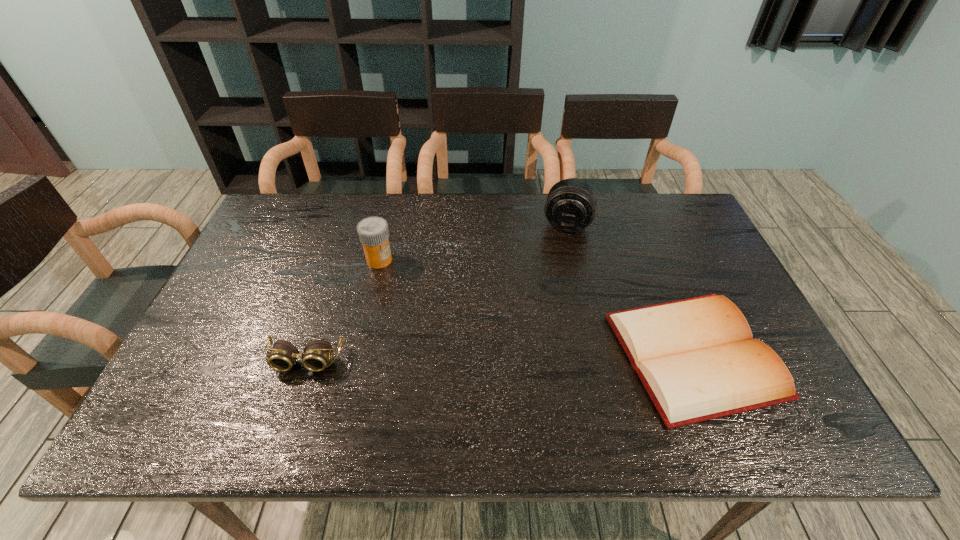
Where is `vacant area at the left edge`? The image size is (960, 540). vacant area at the left edge is located at coordinates (220, 363).

I want to click on vacant region at the right edge, so click(x=712, y=270).

Locate an element on the screen. This screenshot has width=960, height=540. vacant region at the far left corner is located at coordinates (300, 232).

This screenshot has height=540, width=960. In the image, there is a desktop. Identify the location of blank space at the near left corner. (185, 378).

Locate an element on the screen. The height and width of the screenshot is (540, 960). free location at the far right corner of the desktop is located at coordinates [x=670, y=200].

Find the location of a particular element. vacant space that is in between the medicine and the second shortest object is located at coordinates (343, 310).

Where is `vacant region between the Bible and the third shortest object`? This screenshot has height=540, width=960. vacant region between the Bible and the third shortest object is located at coordinates (537, 307).

This screenshot has height=540, width=960. Identify the location of unoccupied area between the third shortest object and the tallest object. (473, 241).

Where is `free spot between the tallest object and the third tallest object`? Image resolution: width=960 pixels, height=540 pixels. free spot between the tallest object and the third tallest object is located at coordinates (436, 292).

Where is `free space between the medicine and the shortest object`? The height and width of the screenshot is (540, 960). free space between the medicine and the shortest object is located at coordinates (537, 307).